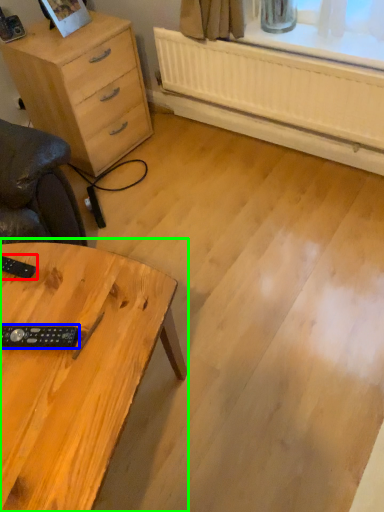
Question: Estimate the real-world distances between objects in this image. Which object is farther from control (highlighted by a red box), control (highlighted by a blue box) or table (highlighted by a green box)?

Choices:
 (A) control
 (B) table

Answer: (B)